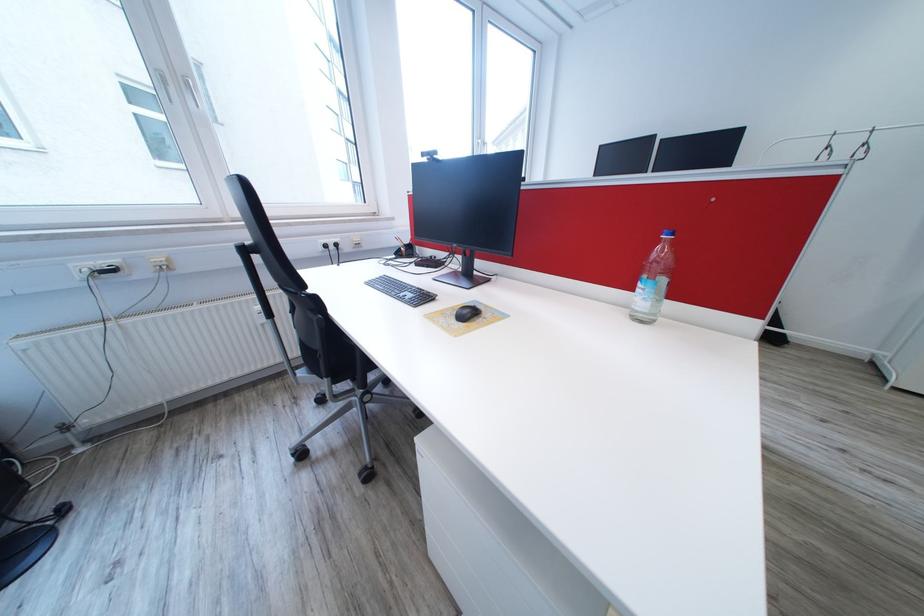
Where would you typ the black computer keyboard? Please return your answer as a coordinate pair (x, y).

(400, 290)